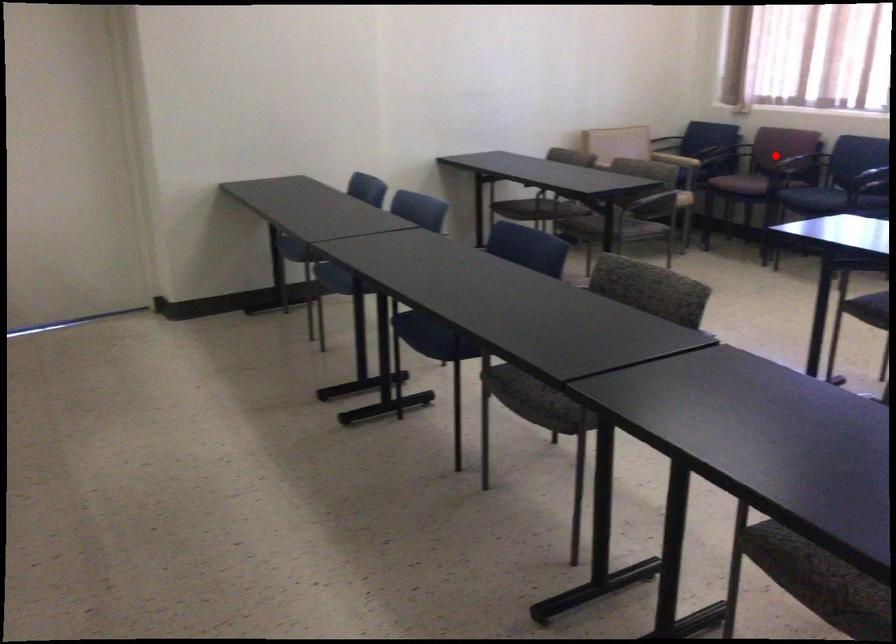
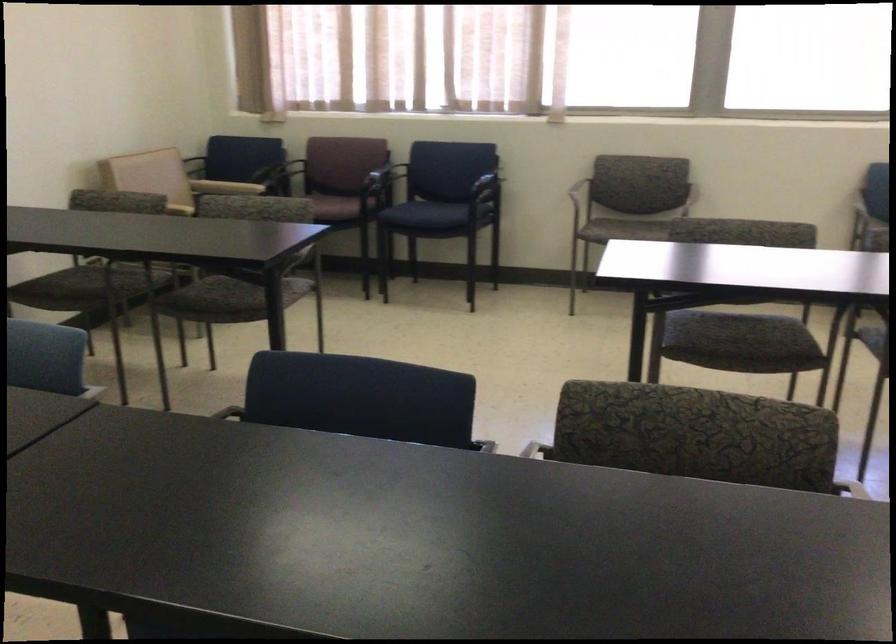
Question: I am providing you with two images of the same scene from different viewpoints. A red point is marked on the first image. At the location where the point appears in image 1, is it still visible in image 2?

Choices:
 (A) Yes
 (B) No

Answer: (B)